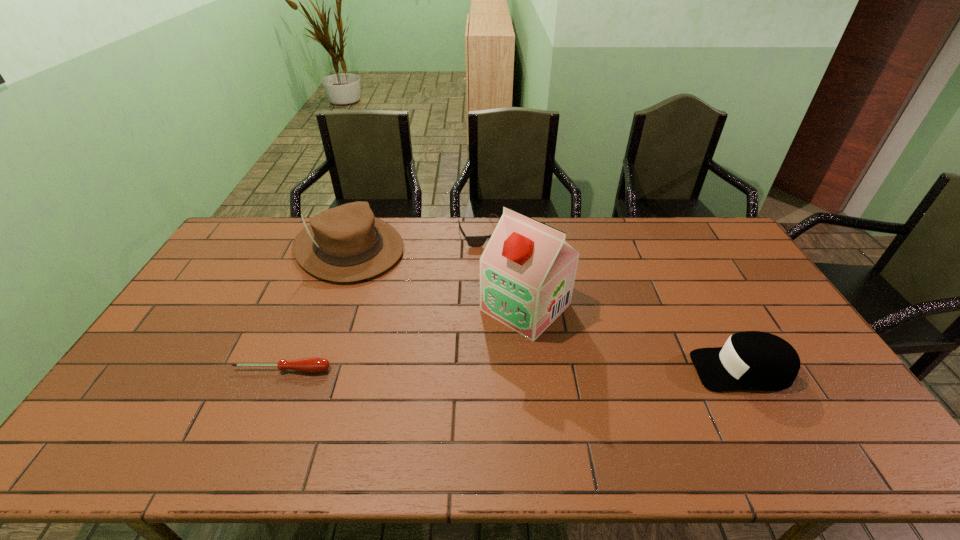
Identify the location of empty space between the cap and the tallest object. (634, 338).

Identify the location of free space between the second tallest object and the soya milk. (437, 278).

The image size is (960, 540). Identify the location of empty location between the second tallest object and the shortest object. (316, 309).

Locate an element on the screen. This screenshot has height=540, width=960. free space between the rightmost object and the sunglasses is located at coordinates (612, 301).

Locate an element on the screen. This screenshot has height=540, width=960. vacant space that is in between the shortest object and the third tallest object is located at coordinates click(512, 370).

Identify the location of vacant area between the shortest object and the third shortest object. (512, 370).

Find the location of a particular element. empty space between the cap and the second shortest object is located at coordinates (612, 301).

Identify the location of blank region between the screwdriver and the second tallest object. (316, 309).

Identify the location of vacant point located between the rightmost object and the tallest object. (634, 338).

Identify the location of vacant area that lies between the sunglasses and the rightmost object. This screenshot has width=960, height=540. (612, 301).